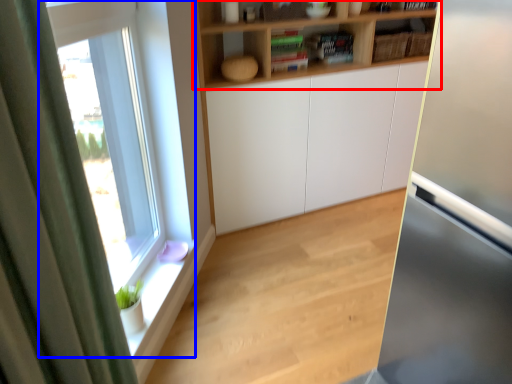
Question: Which object is closer to the camera taking this photo, shelf (highlighted by a red box) or window (highlighted by a blue box)?

Choices:
 (A) shelf
 (B) window

Answer: (B)